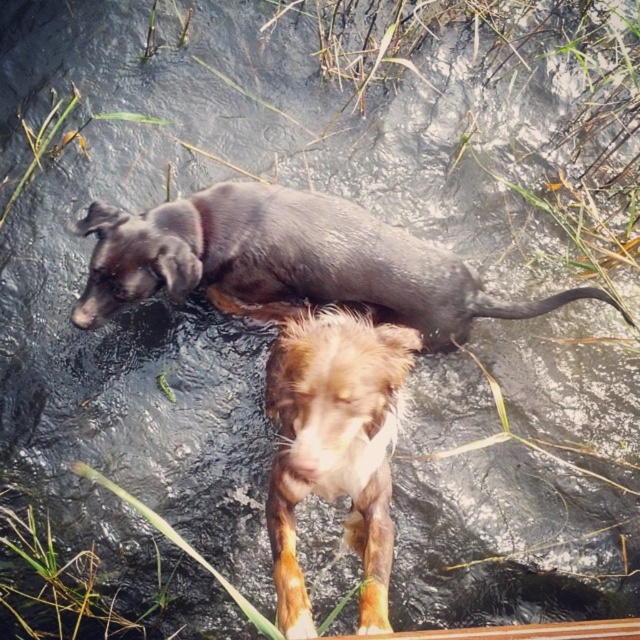
Question: Which point is closer to the camera?

Choices:
 (A) brown furry dog at center
 (B) shiny black dog at upper center

Answer: (A)

Question: Is shiny black dog at upper center positioned before brown furry dog at center?

Choices:
 (A) yes
 (B) no

Answer: (B)

Question: Does shiny black dog at upper center appear on the right side of brown furry dog at center?

Choices:
 (A) no
 (B) yes

Answer: (B)

Question: Is shiny black dog at upper center bigger than brown furry dog at center?

Choices:
 (A) yes
 (B) no

Answer: (A)

Question: Which of the following is the closest to the observer?

Choices:
 (A) (371, 496)
 (B) (381, 276)

Answer: (A)